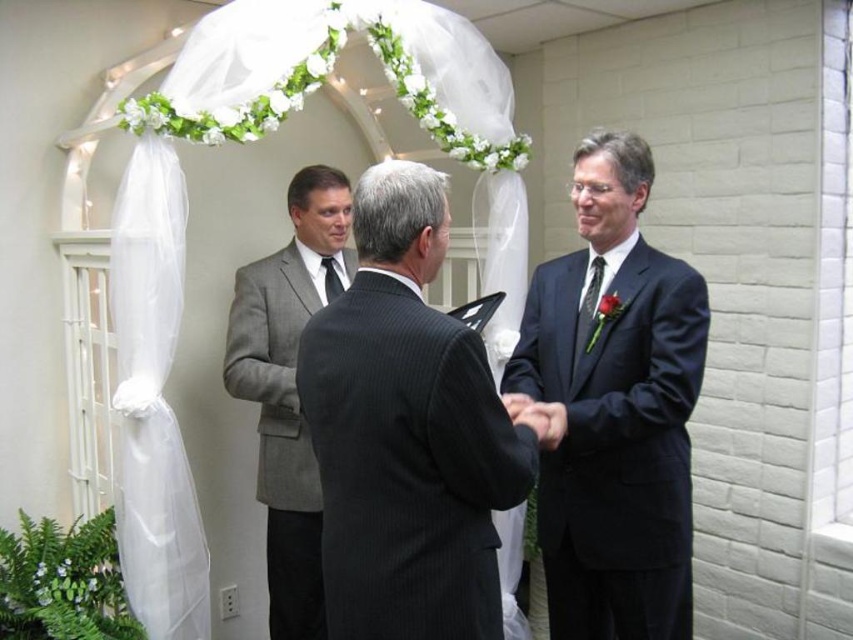
You are a photographer at the wedding ceremony and need to position your camera to capture the dark gray pinstripe suit at center. What are the coordinates where you should aim your camera?

The coordinates for the dark gray pinstripe suit at center are at point (407, 433).

You are a photographer at a wedding ceremony. You need to position yourself so that both the dark gray pinstripe suit at center and the matte black suit at right are visible in your frame. Which of the two suits should you focus on to ensure both are in the shot without needing to adjust your camera angle?

The dark gray pinstripe suit at center is shorter than the matte black suit at right, so focusing on the taller matte black suit at right will help ensure both are visible in the frame without adjusting the camera angle.

Please write a question that asks about the position of the matte black suit at right in the wedding scene using the provided scene description and objects. Ensure the question does not include any details from the objects description and strictly adheres to the rules.

The matte black suit at right is located at the coordinates (613, 408) in the image.